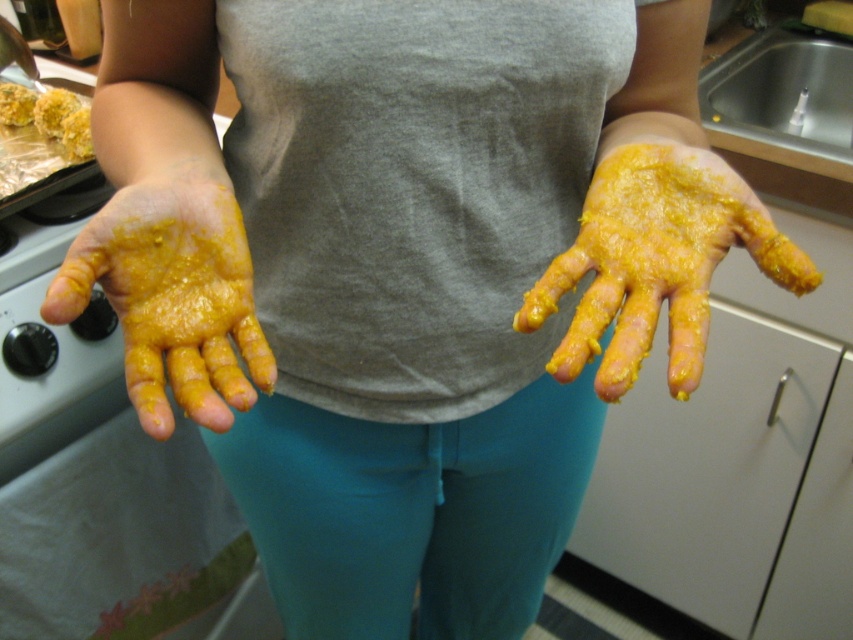
Question: Is yellow matte hand at left to the left of yellow crumbly food at left from the viewer's perspective?

Choices:
 (A) no
 (B) yes

Answer: (A)

Question: Is yellow matte hand at center closer to the viewer compared to yellow crumbly food at upper left?

Choices:
 (A) yes
 (B) no

Answer: (A)

Question: Which object is closer to the camera taking this photo?

Choices:
 (A) yellow crumbly food at upper left
 (B) yellow matte hand at left
 (C) yellow matte hand at center
 (D) yellow crumbly food at left

Answer: (B)

Question: Which point is closer to the camera taking this photo?

Choices:
 (A) (784, 262)
 (B) (190, 304)
 (C) (51, 128)

Answer: (B)

Question: Is yellow matte hand at center thinner than yellow crumbly food at left?

Choices:
 (A) yes
 (B) no

Answer: (B)

Question: Among these objects, which one is farthest from the camera?

Choices:
 (A) yellow matte hand at center
 (B) yellow crumbly food at left

Answer: (B)